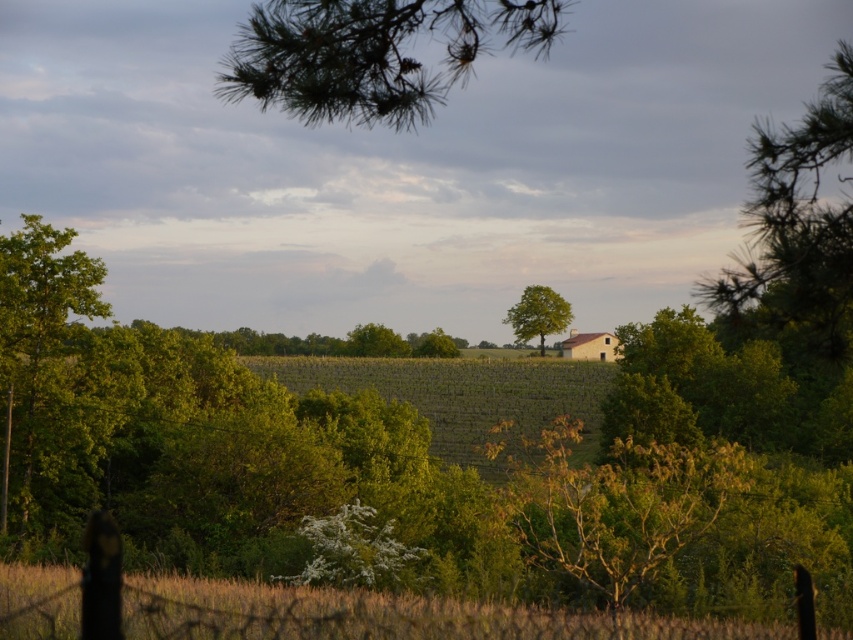
You are standing in the rural landscape scene and want to know which of the two points, point (369, 620) or point (509, 45), is nearer to you. Based on the scene description, can you determine which point is closer?

Point (369, 620) is closer to the camera than point (509, 45), so it is the nearer one.